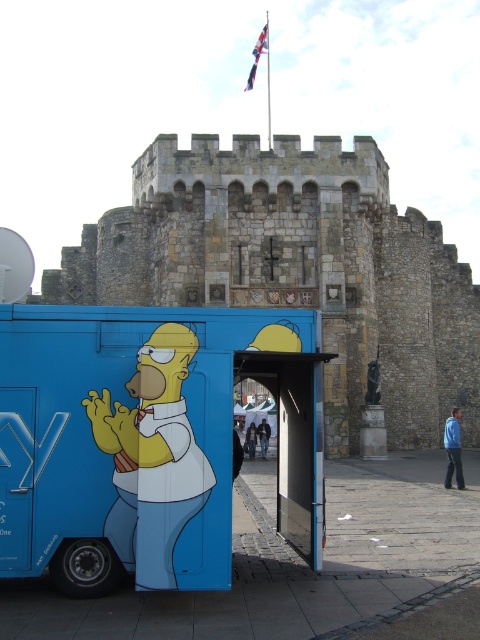
Does matte blue food truck at center have a lesser width compared to stone castle at center?

Indeed, matte blue food truck at center has a lesser width compared to stone castle at center.

Is matte blue food truck at center smaller than stone castle at center?

Indeed, matte blue food truck at center has a smaller size compared to stone castle at center.

At what (x,y) coordinates should I click in order to perform the action: click on matte blue food truck at center. Please return your answer as a coordinate pair (x, y). The image size is (480, 640). Looking at the image, I should click on (147, 440).

Where is `matte blue food truck at center`? The height and width of the screenshot is (640, 480). matte blue food truck at center is located at coordinates (147, 440).